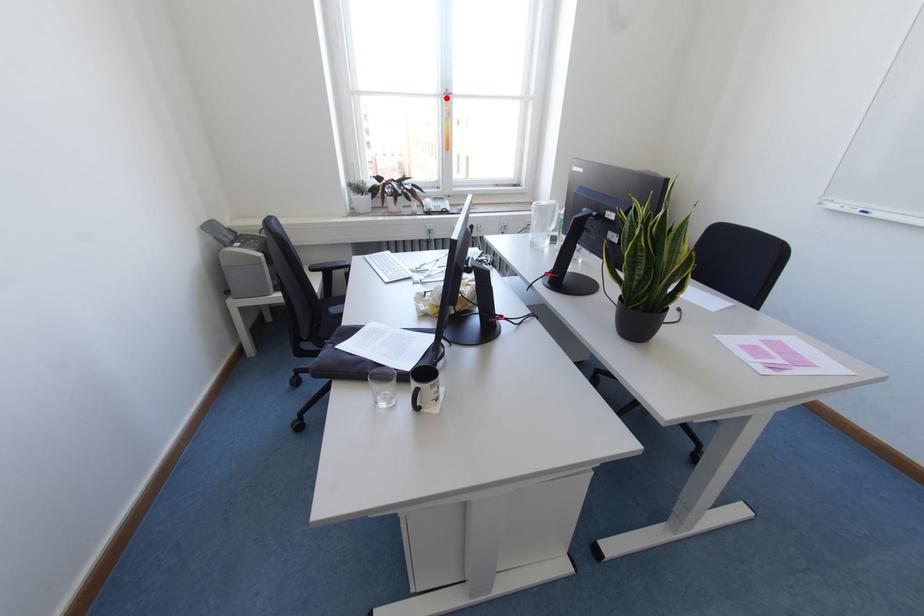
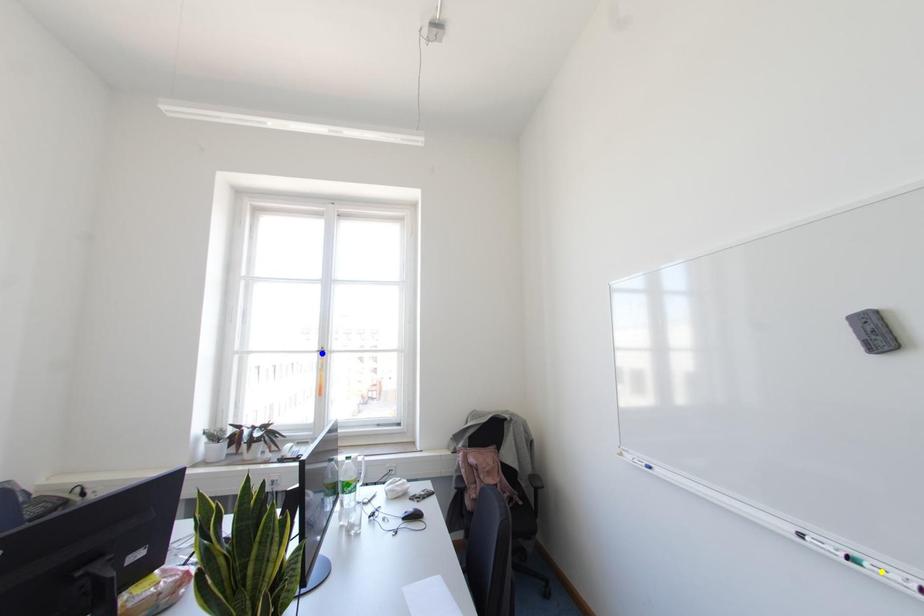
Question: I am providing you with two images of the same scene from different viewpoints. A red point is marked on the first image. You are given multiple points on the second image. Which mark in image 2 goes with the point in image 1?

Choices:
 (A) yellow point
 (B) blue point
 (C) green point

Answer: (B)